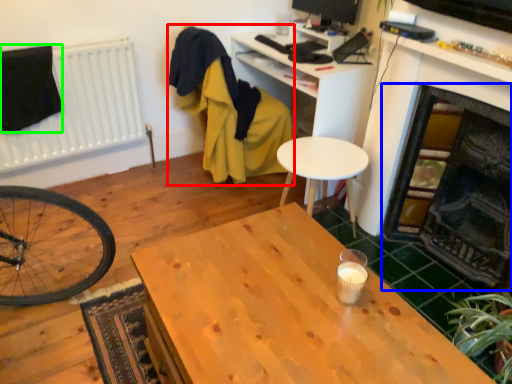
Question: Considering the real-world distances, which object is closest to swivel chair (highlighted by a red box)? fireplace (highlighted by a blue box) or clothe (highlighted by a green box).

Choices:
 (A) fireplace
 (B) clothe

Answer: (B)